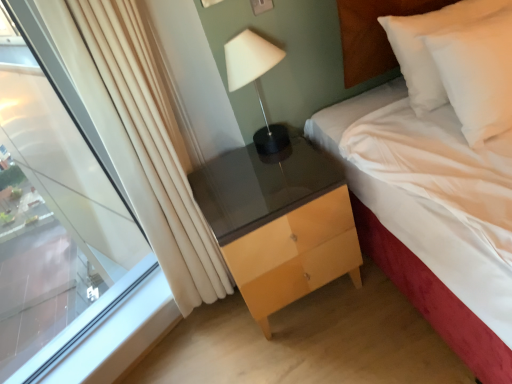
Question: In terms of width, does matte black lamp at upper center look wider or thinner when compared to white soft pillow at upper right?

Choices:
 (A) wide
 (B) thin

Answer: (B)

Question: From a real-world perspective, is matte black lamp at upper center positioned above or below white soft pillow at upper right?

Choices:
 (A) above
 (B) below

Answer: (A)

Question: Estimate the real-world distances between objects in this image. Which object is closer to the matte wood chest of drawers at center?

Choices:
 (A) transparent glass window at left
 (B) matte black lamp at upper center
 (C) white soft pillow at upper right
 (D) white soft bed at center

Answer: (D)

Question: Which is farther from the matte black lamp at upper center?

Choices:
 (A) white soft pillow at upper right
 (B) transparent glass window at left
 (C) white soft bed at center
 (D) matte wood chest of drawers at center

Answer: (B)